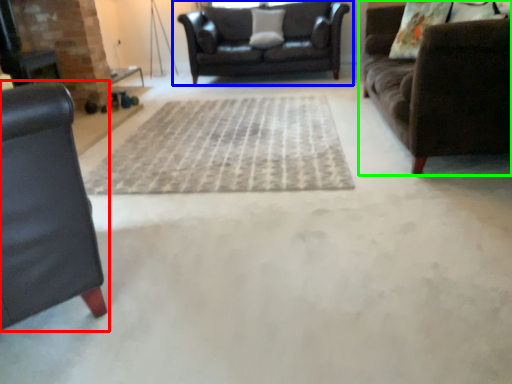
Question: Estimate the real-world distances between objects in this image. Which object is farther from studio couch (highlighted by a red box), studio couch (highlighted by a blue box) or studio couch (highlighted by a green box)?

Choices:
 (A) studio couch
 (B) studio couch

Answer: (A)